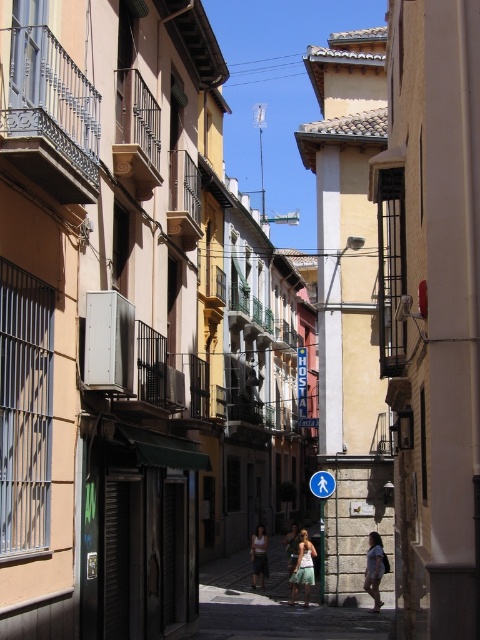
Question: Is matte concrete alley at center below white cotton tank top at center?

Choices:
 (A) no
 (B) yes

Answer: (B)

Question: Which object is positioned farthest from the white cotton tank top at center?

Choices:
 (A) green fabric skirt at center
 (B) matte concrete alley at center

Answer: (A)

Question: In this image, where is matte concrete alley at center located relative to green fabric skirt at center?

Choices:
 (A) below
 (B) above

Answer: (A)

Question: Is white cotton tank top at center to the left of blue plastic pedestrian sign at center from the viewer's perspective?

Choices:
 (A) no
 (B) yes

Answer: (B)

Question: Which object is positioned closest to the light blue fabric dress at center?

Choices:
 (A) blue plastic pedestrian sign at center
 (B) green fabric skirt at center
 (C) matte concrete alley at center

Answer: (B)

Question: Which object is closer to the camera taking this photo?

Choices:
 (A) blue plastic pedestrian sign at center
 (B) matte concrete alley at center
 (C) light blue fabric dress at center
 (D) green fabric skirt at center

Answer: (B)